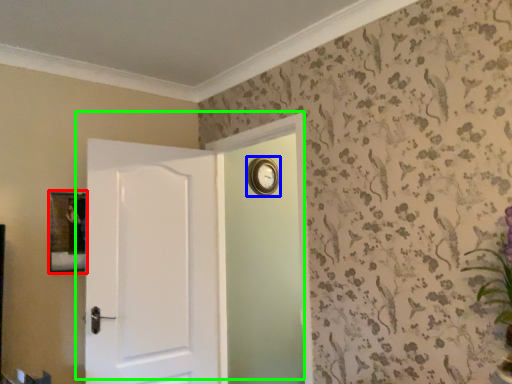
Question: Based on their relative distances, which object is farther from picture frame (highlighted by a red box)? Choose from clock (highlighted by a blue box) and door (highlighted by a green box).

Choices:
 (A) clock
 (B) door

Answer: (A)